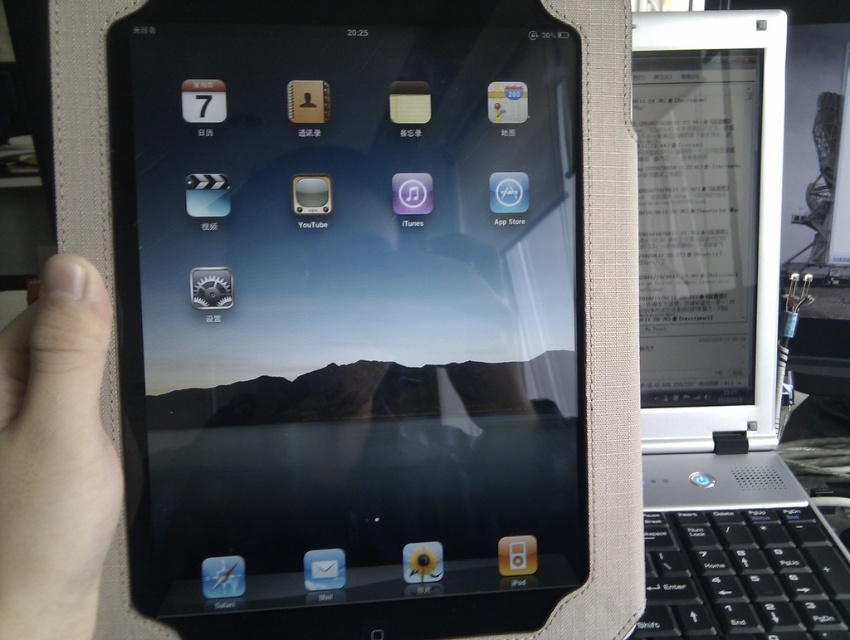
You are looking at the tablet screen and notice a specific point at coordinates (347, 312). What object is located at that point?

The point at coordinates (347, 312) is where the black matte tablet at center is located.